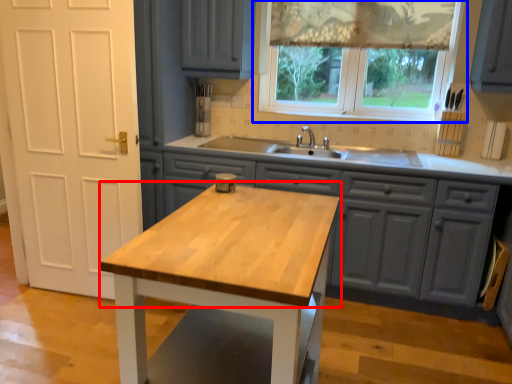
Question: Which point is closer to the camera, countertop (highlighted by a red box) or window (highlighted by a blue box)?

Choices:
 (A) countertop
 (B) window

Answer: (A)